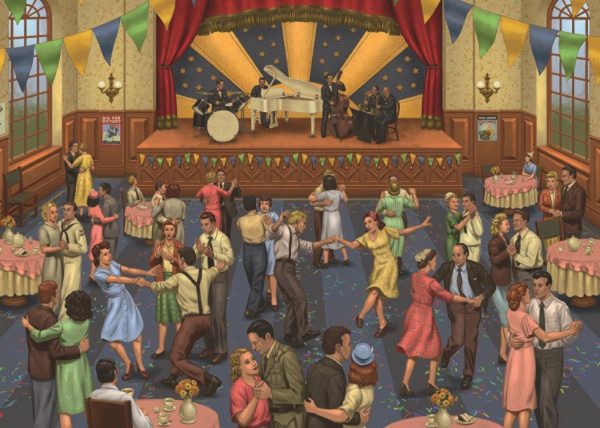
Identify the location of flyer on right wall. (485, 127).